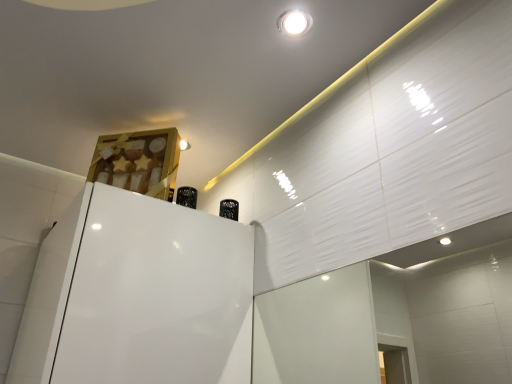
Locate an element on the screen. This screenshot has width=512, height=384. gold foil box at upper left is located at coordinates point(138,162).

This screenshot has width=512, height=384. What do you see at coordinates (138, 162) in the screenshot? I see `gold foil box at upper left` at bounding box center [138, 162].

Find the location of a particular element. The image size is (512, 384). gold foil box at upper left is located at coordinates (138, 162).